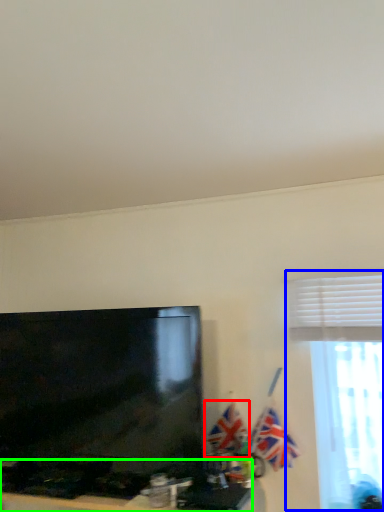
Question: Based on their relative distances, which object is nearer to flag (highlighted by a red box)? Choose from window (highlighted by a blue box) and furniture (highlighted by a green box).

Choices:
 (A) window
 (B) furniture

Answer: (B)